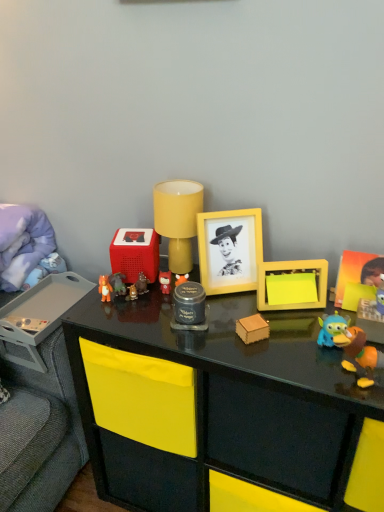
Question: Does matte plastic toy at center, the tenth toy when ordered from right to left, have a smaller size compared to yellow matte table lamp at center?

Choices:
 (A) no
 (B) yes

Answer: (B)

Question: Can you confirm if matte plastic toy at center, the tenth toy when ordered from right to left, is thinner than yellow matte table lamp at center?

Choices:
 (A) no
 (B) yes

Answer: (B)

Question: From a real-world perspective, is matte plastic toy at center, the tenth toy when ordered from right to left, located higher than yellow matte table lamp at center?

Choices:
 (A) no
 (B) yes

Answer: (A)

Question: From a real-world perspective, is matte plastic toy at center, positioned as the 2th toy in left-to-right order, physically below yellow matte table lamp at center?

Choices:
 (A) yes
 (B) no

Answer: (A)

Question: Is matte plastic toy at center, the tenth toy when ordered from right to left, in contact with yellow matte table lamp at center?

Choices:
 (A) no
 (B) yes

Answer: (A)

Question: Visually, is yellow matte picture frame at upper right, which is the second picture frame in left-to-right order, positioned to the left or to the right of yellow matte sticky notes at center-right, marked as the 3th toy in a right-to-left arrangement?

Choices:
 (A) right
 (B) left

Answer: (A)

Question: Considering the positions of yellow matte picture frame at upper right, which is the second picture frame in left-to-right order, and yellow matte sticky notes at center-right, marked as the ninth toy in a left-to-right arrangement, in the image, is yellow matte picture frame at upper right, which is the second picture frame in left-to-right order, wider or thinner than yellow matte sticky notes at center-right, marked as the ninth toy in a left-to-right arrangement,?

Choices:
 (A) thin
 (B) wide

Answer: (A)

Question: Based on their sizes in the image, would you say yellow matte picture frame at upper right, the first picture frame from the right, is bigger or smaller than yellow matte sticky notes at center-right, marked as the ninth toy in a left-to-right arrangement?

Choices:
 (A) small
 (B) big

Answer: (B)

Question: Is point (379, 276) positioned closer to the camera than point (294, 305)?

Choices:
 (A) farther
 (B) closer

Answer: (B)

Question: Considering the positions of yellow matte sticky notes at center-right, marked as the 3th toy in a right-to-left arrangement, and yellow matte picture frame at center, the second picture frame viewed from the right, in the image, is yellow matte sticky notes at center-right, marked as the 3th toy in a right-to-left arrangement, taller or shorter than yellow matte picture frame at center, the second picture frame viewed from the right,?

Choices:
 (A) short
 (B) tall

Answer: (A)

Question: From a real-world perspective, relative to yellow matte picture frame at center, the second picture frame viewed from the right, is yellow matte sticky notes at center-right, marked as the ninth toy in a left-to-right arrangement, vertically above or below?

Choices:
 (A) above
 (B) below

Answer: (B)

Question: Looking at their shapes, would you say yellow matte sticky notes at center-right, marked as the ninth toy in a left-to-right arrangement, is wider or thinner than yellow matte picture frame at center, acting as the first picture frame starting from the left?

Choices:
 (A) thin
 (B) wide

Answer: (A)

Question: Is point (x=261, y=303) positioned closer to the camera than point (x=208, y=282)?

Choices:
 (A) closer
 (B) farther

Answer: (A)

Question: Would you say black glossy desk at center is to the left or to the right of matte black jar at center, the 5th toy viewed from the right, in the picture?

Choices:
 (A) right
 (B) left

Answer: (A)

Question: Is black glossy desk at center spatially inside matte black jar at center, the 5th toy viewed from the right, or outside of it?

Choices:
 (A) inside
 (B) outside

Answer: (B)